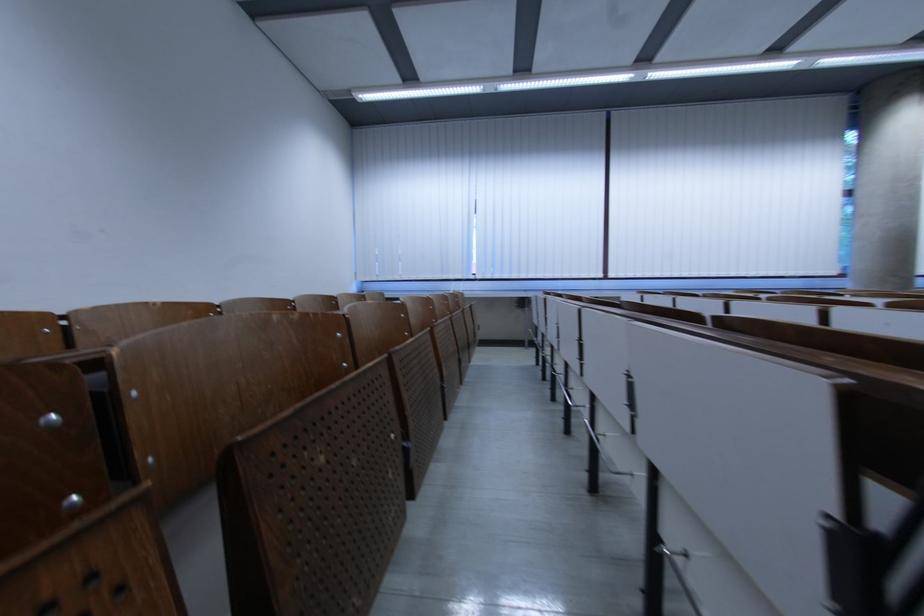
Where would you pull the blind pull cord? Please return your answer as a coordinate pair (x, y).

(643, 74)